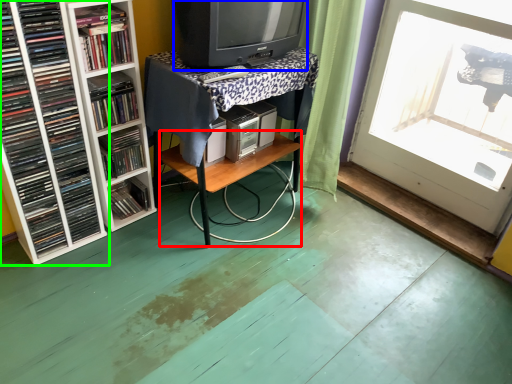
Question: Considering the real-world distances, which object is closest to table (highlighted by a red box)? television (highlighted by a blue box) or book (highlighted by a green box).

Choices:
 (A) television
 (B) book

Answer: (A)